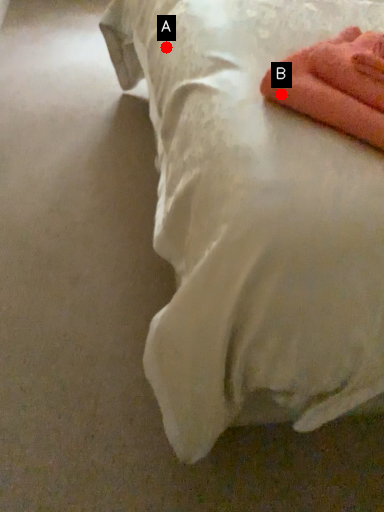
Question: Two points are circled on the image, labeled by A and B beside each circle. Which point appears closest to the camera in this image?

Choices:
 (A) A is closer
 (B) B is closer

Answer: (B)